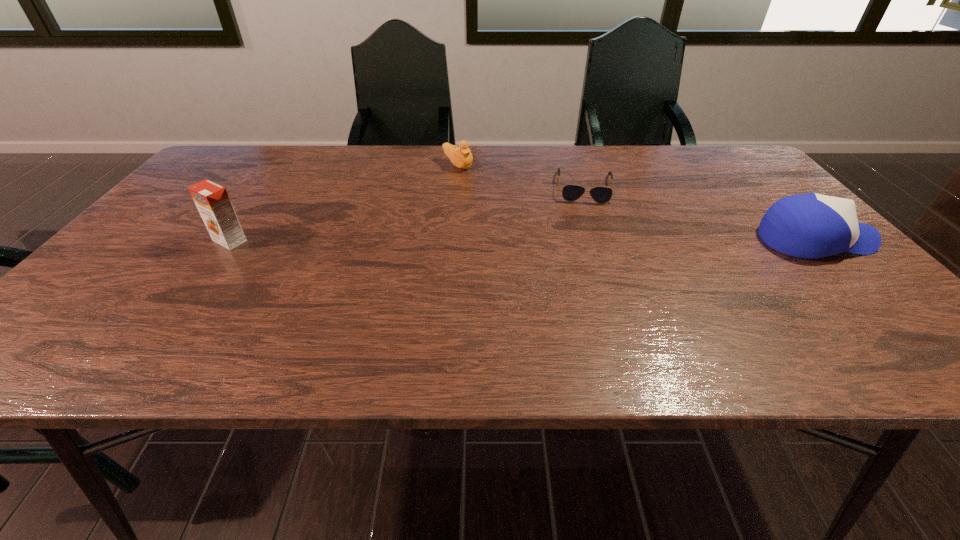
This screenshot has height=540, width=960. I want to click on free space at the left edge, so click(x=140, y=247).

Locate an element on the screen. vacant area at the far left corner of the desktop is located at coordinates (199, 178).

Where is `free space at the far right corner of the desktop`? This screenshot has width=960, height=540. free space at the far right corner of the desktop is located at coordinates (708, 159).

At what (x,y) coordinates should I click in order to perform the action: click on free space between the baseball cap and the leftmost object. Please return your answer as a coordinate pair (x, y). This screenshot has width=960, height=540. Looking at the image, I should click on (523, 240).

The height and width of the screenshot is (540, 960). I want to click on vacant area between the tallest object and the second object from left to right, so click(344, 203).

This screenshot has height=540, width=960. Identify the location of free space between the second tallest object and the sunglasses. (700, 213).

Identify the location of unoccupied area between the second object from right to left and the second shortest object. This screenshot has width=960, height=540. (521, 176).

The height and width of the screenshot is (540, 960). Identify the location of empty space between the second shortest object and the leftmost object. pos(344,203).

The height and width of the screenshot is (540, 960). I want to click on free spot between the baseball cap and the third tallest object, so click(x=636, y=203).

At what (x,y) coordinates should I click in order to perform the action: click on empty space that is in between the baseball cap and the second object from left to right. Please return your answer as a coordinate pair (x, y). Looking at the image, I should click on (636, 203).